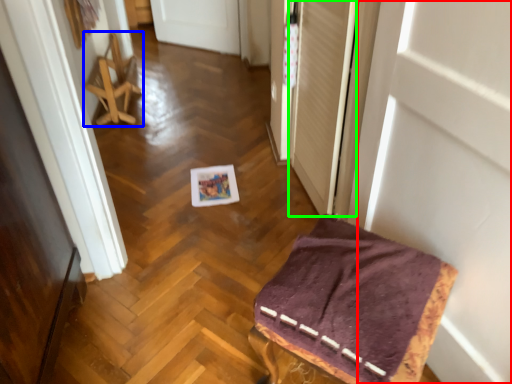
Question: Which object is the farthest from door (highlighted by a red box)? Choose among these: furniture (highlighted by a blue box) or screen door (highlighted by a green box).

Choices:
 (A) furniture
 (B) screen door

Answer: (A)